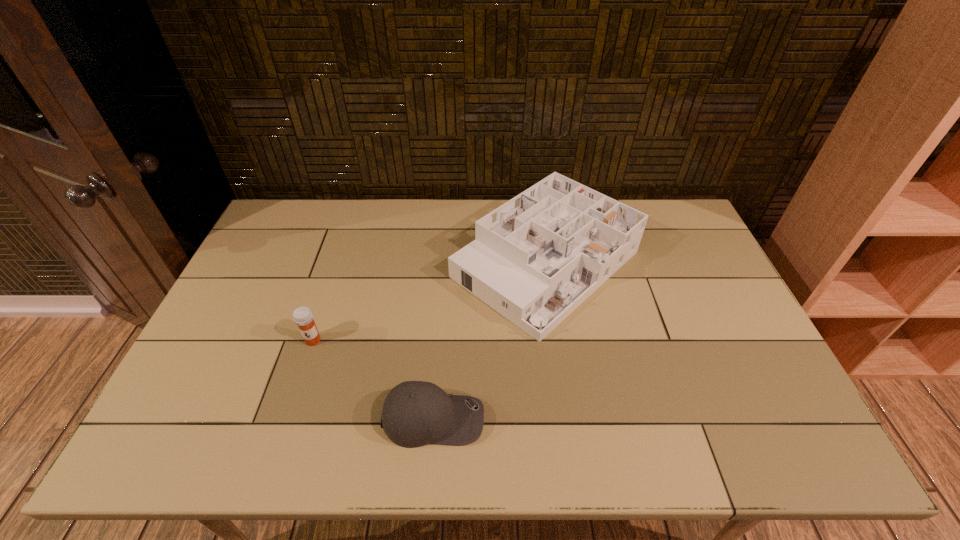
The width and height of the screenshot is (960, 540). Find the location of `free space at the far left corner of the desktop`. free space at the far left corner of the desktop is located at coordinates (294, 210).

What are the coordinates of `free space at the near left corner` in the screenshot? It's located at (147, 456).

In the image, there is a desktop. Identify the location of free space at the far right corner. (667, 216).

Find the location of a particular element. unoccupied position between the leftmost object and the tallest object is located at coordinates (429, 302).

At what (x,y) coordinates should I click in order to perform the action: click on blank region between the tallest object and the leftmost object. Please return your answer as a coordinate pair (x, y). Looking at the image, I should click on (429, 302).

Locate an element on the screen. vacant area that lies between the dollhouse and the nearest object is located at coordinates (490, 341).

The width and height of the screenshot is (960, 540). Find the location of `free space between the baseball cap and the leftmost object`. free space between the baseball cap and the leftmost object is located at coordinates (373, 380).

Identify the location of blank region between the dollhouse and the baseball cap. (490, 341).

This screenshot has width=960, height=540. What are the coordinates of `free area in between the leftmost object and the baseball cap` in the screenshot? It's located at (373, 380).

This screenshot has height=540, width=960. I want to click on empty location between the tallest object and the medicine, so click(429, 302).